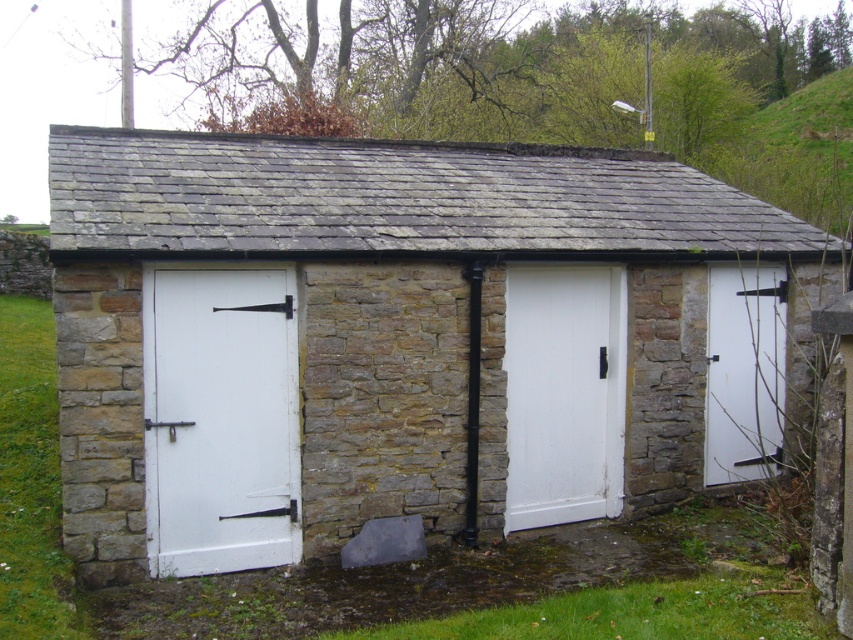
You are standing in front of the small stone building with three white doors. You notice a point marked at coordinates (219, 419). Which door does this point belong to?

The point at (219, 419) is on the white painted wood door at left.

You are a delivery person approaching the stone building and need to enter through one of the doors. You notice two doors, the white painted wood door at center and the white matte door at right. Which door is positioned higher up on the building?

The white painted wood door at center is positioned higher up on the building compared to the white matte door at right, as it is located above it.

You are standing in front of the small stone building and need to enter the white painted wood door at center. Which direction should you walk relative to the white painted wood door at left to reach it?

The white painted wood door at center is to the right of the white painted wood door at left. To reach it, you should walk to the right side of the white painted wood door at left.